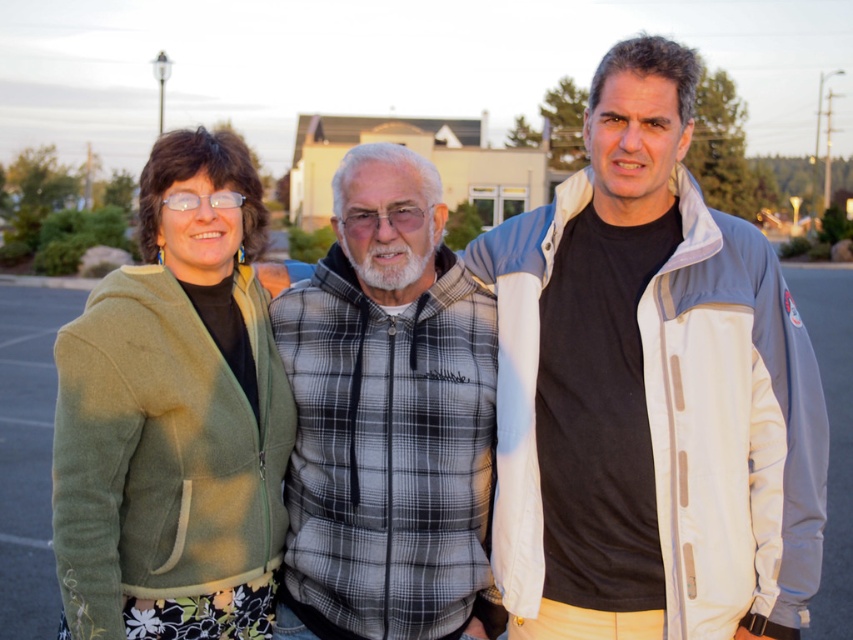
Between green fleece jacket at left and plaid fabric vest at center, which one has less height?

green fleece jacket at left is shorter.

Between green fleece jacket at left and plaid fabric vest at center, which one appears on the left side from the viewer's perspective?

green fleece jacket at left is more to the left.

Where is `green fleece jacket at left`? This screenshot has height=640, width=853. green fleece jacket at left is located at coordinates (173, 417).

Does white/light blue jacket at center have a larger size compared to plaid fabric vest at center?

Yes, white/light blue jacket at center is bigger than plaid fabric vest at center.

Is white/light blue jacket at center positioned before plaid fabric vest at center?

That is True.

Which is in front, point (503, 256) or point (341, 248)?

Point (341, 248) is in front.

Locate an element on the screen. This screenshot has height=640, width=853. white/light blue jacket at center is located at coordinates (648, 392).

Looking at this image, how far apart are white/light blue jacket at center and green fleece jacket at left?

1.26 meters

Who is more distant from viewer, (601, 230) or (102, 490)?

Positioned behind is point (601, 230).

Image resolution: width=853 pixels, height=640 pixels. What do you see at coordinates (648, 392) in the screenshot? I see `white/light blue jacket at center` at bounding box center [648, 392].

The height and width of the screenshot is (640, 853). Find the location of `white/light blue jacket at center`. white/light blue jacket at center is located at coordinates (648, 392).